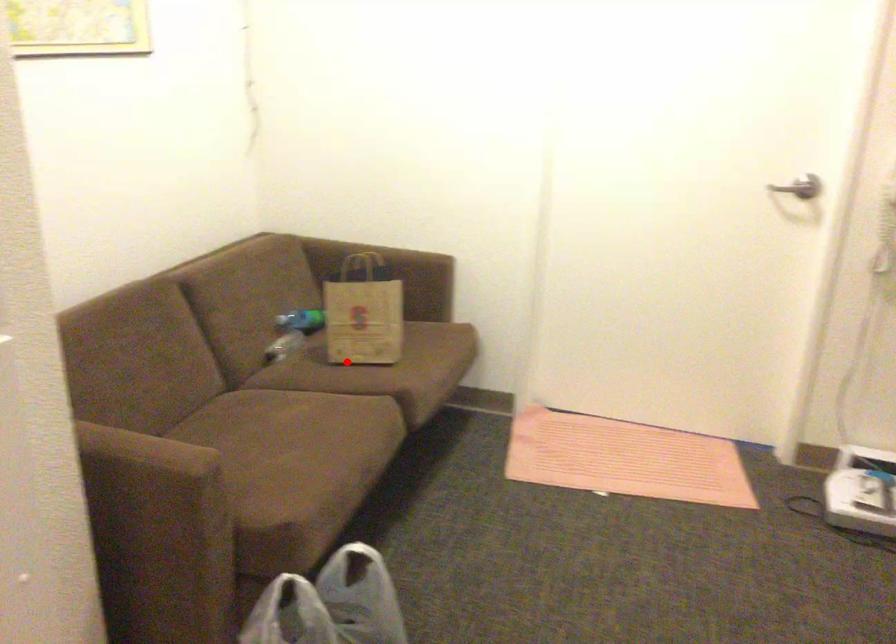
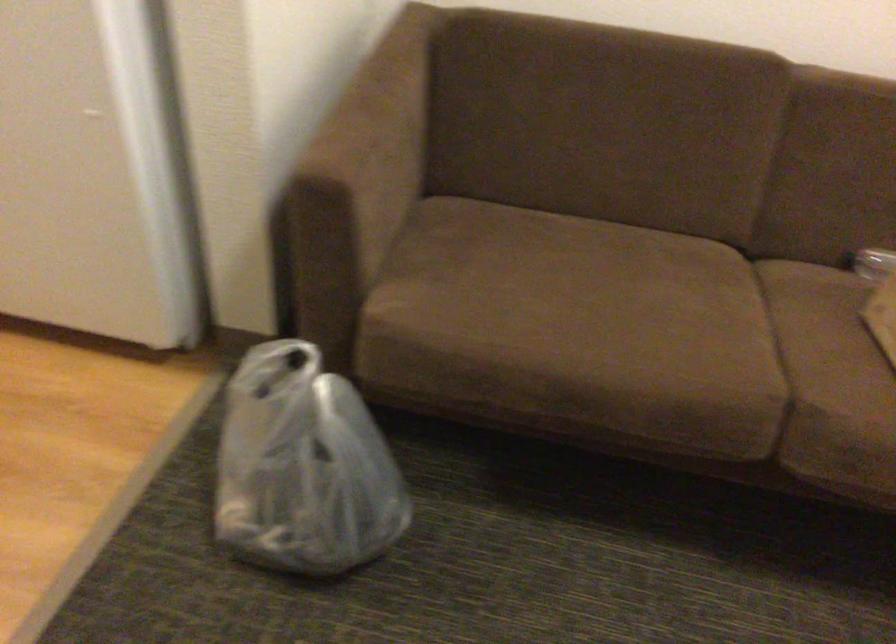
Locate, in the second image, the point that corresponds to the highlighted location in the first image.

(882, 315)